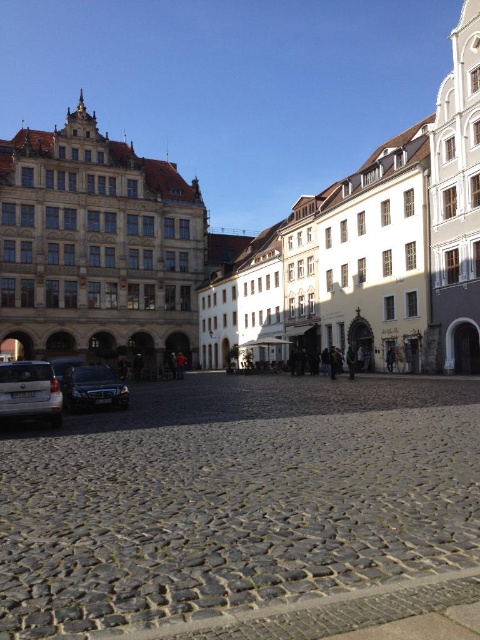
You are a delivery person trying to park your shiny silver car at lower left in the cobblestone square. The parking spot is marked by a gray cobblestone at center. Can your car fit widthwise into the parking spot based on the cobblestone size?

The gray cobblestone at center has a larger width than the shiny silver car at lower left, so the car can fit widthwise into the parking spot.

You are a tourist standing at the edge of the cobblestone square and want to take a photo of the silver metallic van at lower left without including the gray cobblestone at center in the frame. Based on their positions, is this possible?

The gray cobblestone at center is located below the silver metallic van at lower left, so if you position yourself to capture the van while avoiding looking downward towards the cobblestone area, it should be possible to exclude the gray cobblestone at center from the photo.